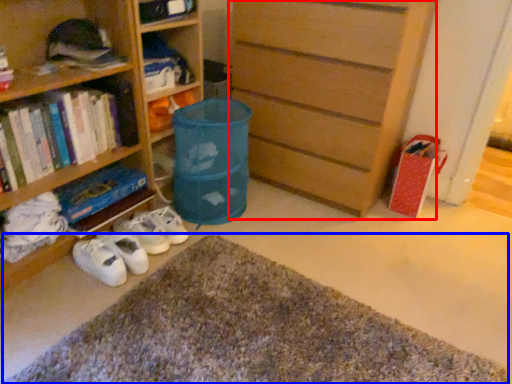
Question: Among these objects, which one is farthest to the camera, chest of drawers (highlighted by a red box) or doormat (highlighted by a blue box)?

Choices:
 (A) chest of drawers
 (B) doormat

Answer: (A)